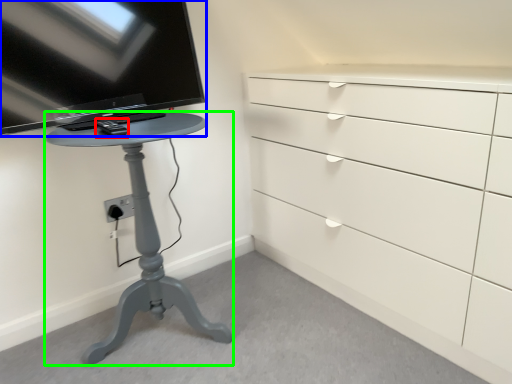
Question: Estimate the real-world distances between objects in this image. Which object is closer to equipment (highlighted by a red box), television (highlighted by a blue box) or furniture (highlighted by a green box)?

Choices:
 (A) television
 (B) furniture

Answer: (A)